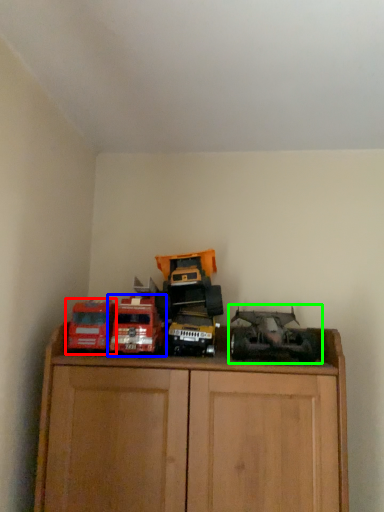
Question: Which is farther away from toy (highlighted by a red box)? toy (highlighted by a blue box) or toy (highlighted by a green box)?

Choices:
 (A) toy
 (B) toy

Answer: (B)